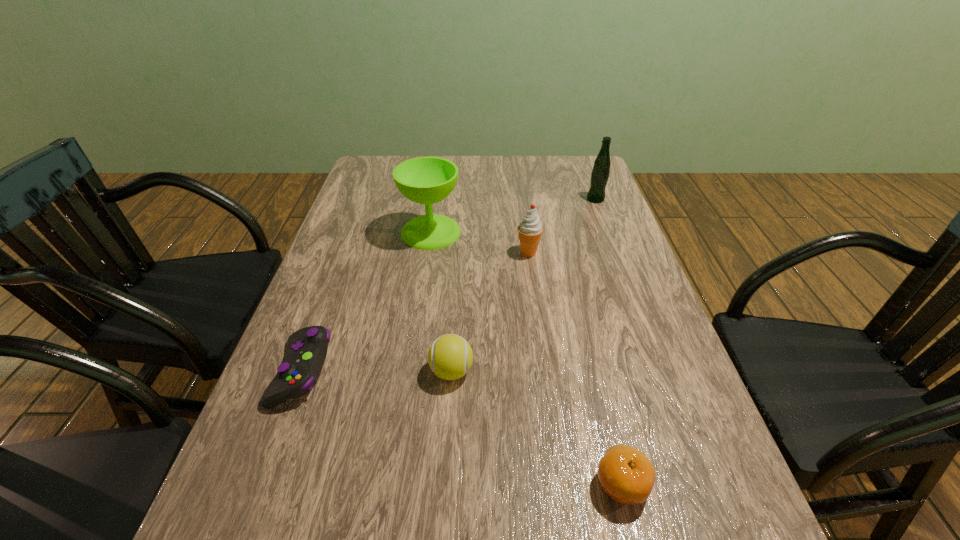
This screenshot has width=960, height=540. In order to click on vacant area between the fifth object from left to right and the wineglass in this screenshot , I will do `click(526, 358)`.

The image size is (960, 540). I want to click on vacant region between the clementine and the fourth object from left to right, so click(x=575, y=368).

Identify which object is located as the nearest to the fourth object from left to right. Please provide its 2D coordinates. Your answer should be formatted as a tuple, i.e. [(x, y)], where the tuple contains the x and y coordinates of a point satisfying the conditions above.

[(425, 180)]

You are a GUI agent. You are given a task and a screenshot of the screen. Output one action in this format:
    pyautogui.click(x=<x>, y=<y>)
    Task: Click on the object that stands as the third closest to the wineglass
    
    Given the screenshot: What is the action you would take?
    pyautogui.click(x=450, y=356)

What are the coordinates of `free spot that satisfies the following two spatial constraints: 1. on the front side of the fourth object from left to right; 2. on the left side of the wineglass` in the screenshot? It's located at (428, 253).

Find the location of a particular element. free space in the image that satisfies the following two spatial constraints: 1. on the front side of the tennis ball; 2. on the right side of the wineglass is located at coordinates (411, 371).

Where is `free location that satisfies the following two spatial constraints: 1. on the front side of the control; 2. on the left side of the clementine`? The width and height of the screenshot is (960, 540). free location that satisfies the following two spatial constraints: 1. on the front side of the control; 2. on the left side of the clementine is located at coordinates (260, 483).